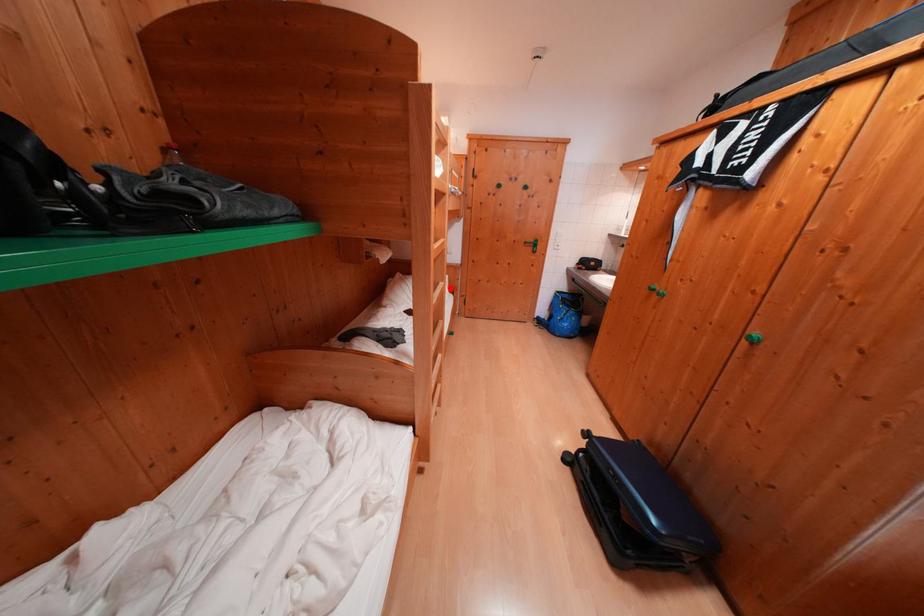
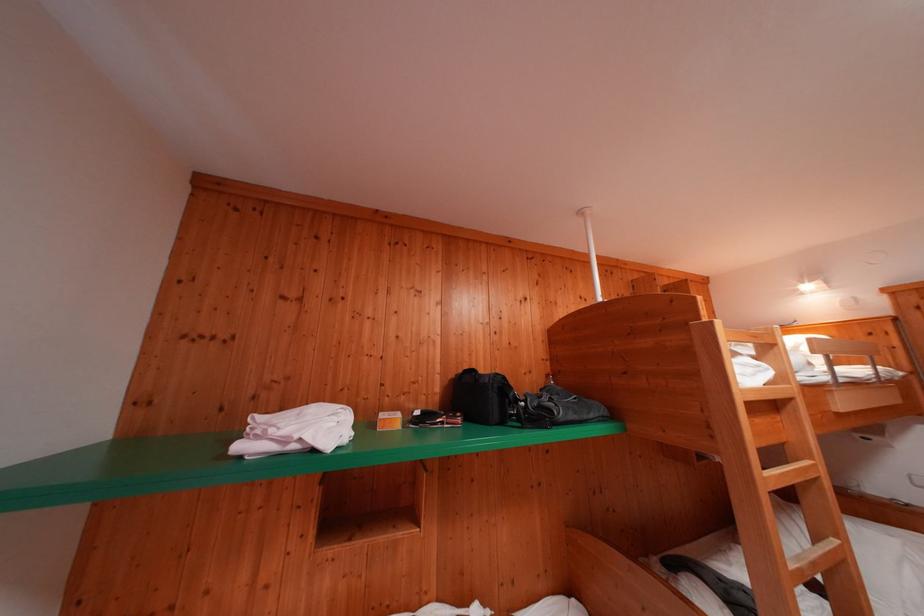
Find the pixel in the second image that matches the highlighted location in the first image.

(843, 545)